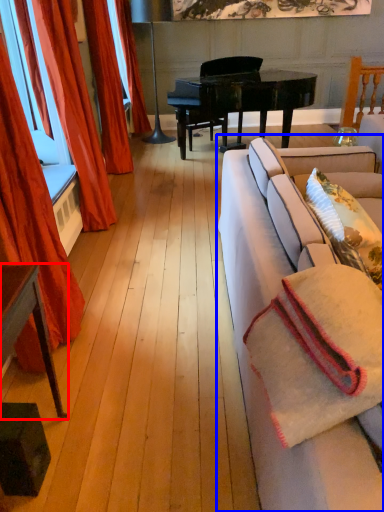
Question: Which point is closer to the camera, table (highlighted by a red box) or studio couch (highlighted by a blue box)?

Choices:
 (A) table
 (B) studio couch

Answer: (B)